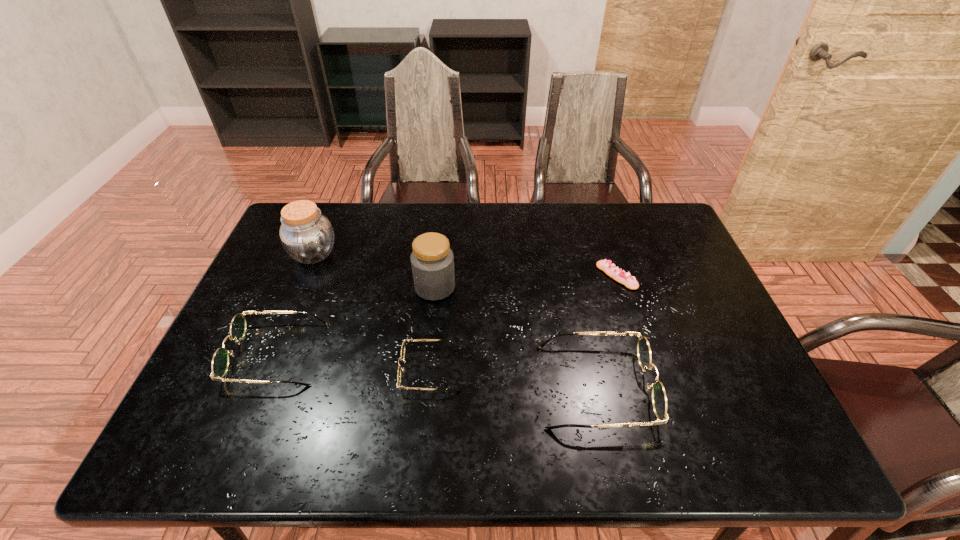
The width and height of the screenshot is (960, 540). I want to click on free space at the far edge of the desktop, so click(x=456, y=206).

At what (x,y) coordinates should I click in order to perform the action: click on vacant space at the near edge. Please return your answer as a coordinate pair (x, y). The width and height of the screenshot is (960, 540). Looking at the image, I should click on point(365,389).

Where is `free space at the left edge`? free space at the left edge is located at coordinates (259, 370).

Where is `free space at the right edge`? The height and width of the screenshot is (540, 960). free space at the right edge is located at coordinates (698, 286).

In the image, there is a desktop. At what (x,y) coordinates should I click in order to perform the action: click on vacant region at the near right corner. Please return your answer as a coordinate pair (x, y). Looking at the image, I should click on (721, 398).

Identify the location of unoccupied position between the left jar and the shortest spectacles. The width and height of the screenshot is (960, 540). (372, 312).

I want to click on free space between the left jar and the rightmost spectacles, so click(454, 320).

The height and width of the screenshot is (540, 960). In order to click on free space that is in between the rightmost spectacles and the fourth tallest object in this screenshot , I will do `click(436, 370)`.

The width and height of the screenshot is (960, 540). I want to click on free spot between the second spectacles from right to left and the right jar, so click(433, 328).

I want to click on free space that is in between the right jar and the eclair, so click(x=526, y=282).